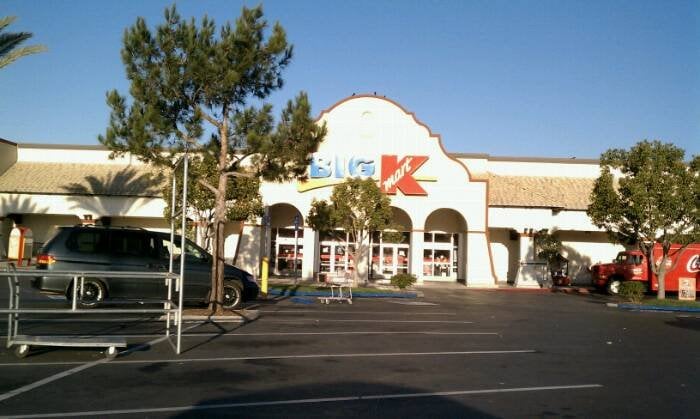
The image size is (700, 419). Find the location of `tropical plant shadow`. tropical plant shadow is located at coordinates click(x=113, y=190), click(x=22, y=213).